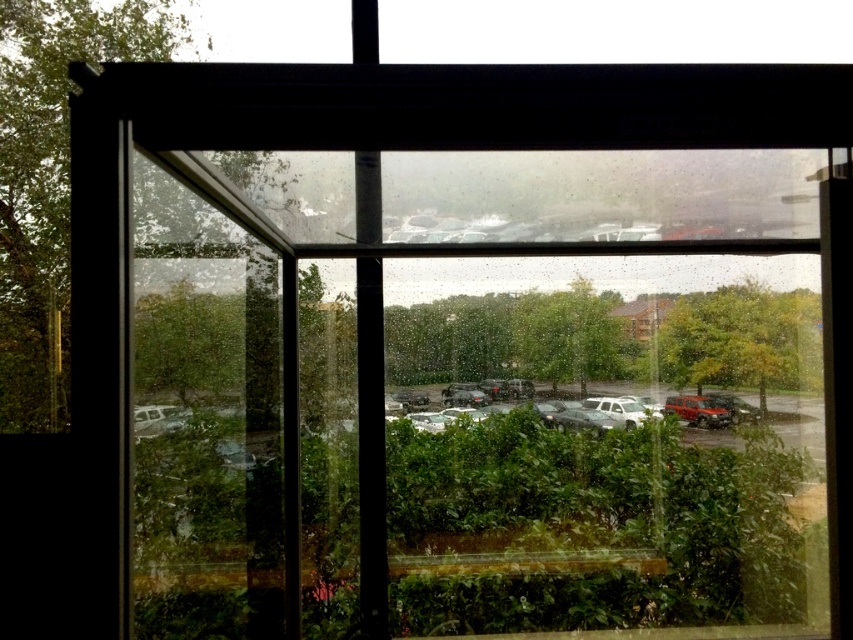
Question: Is matte silver suv at center closer to the viewer compared to matte red suv at lower right?

Choices:
 (A) no
 (B) yes

Answer: (B)

Question: Which object appears closest to the camera in this image?

Choices:
 (A) matte red suv at lower right
 (B) matte silver suv at center
 (C) white matte truck at center

Answer: (C)

Question: Is the position of matte silver suv at center more distant than that of matte red suv at lower right?

Choices:
 (A) yes
 (B) no

Answer: (B)

Question: Is matte silver suv at center behind matte red suv at lower right?

Choices:
 (A) no
 (B) yes

Answer: (A)

Question: Based on their relative distances, which object is farther from the matte red suv at lower right?

Choices:
 (A) matte silver suv at center
 (B) white matte truck at center

Answer: (B)

Question: Which of these objects is positioned closest to the matte silver suv at center?

Choices:
 (A) matte red suv at lower right
 (B) white matte truck at center

Answer: (A)